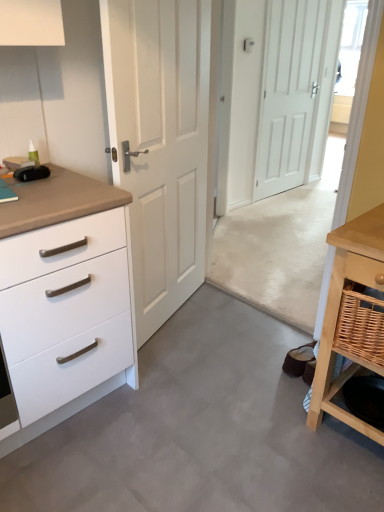
This screenshot has height=512, width=384. In order to click on free spot above gray laminate floor at center (from a real-world perspective) in this screenshot , I will do `click(203, 402)`.